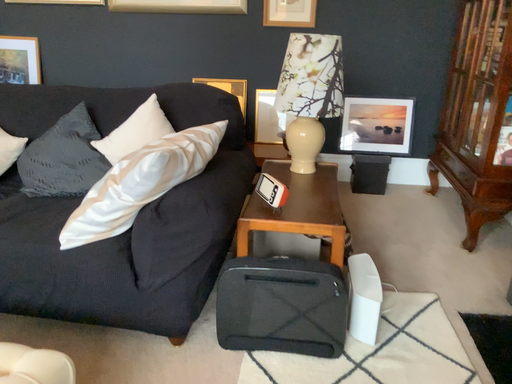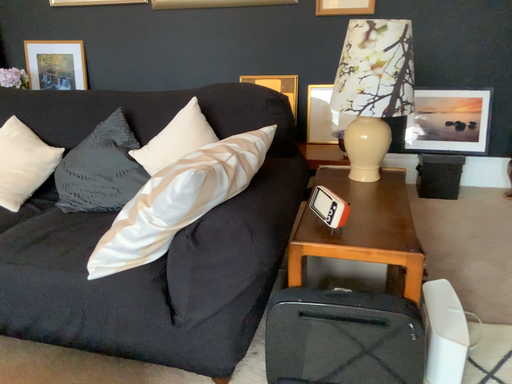
Question: Which way did the camera rotate in the video?

Choices:
 (A) rotated left
 (B) rotated right

Answer: (A)